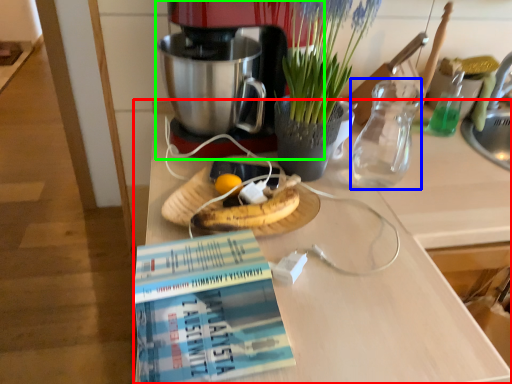
Question: Which object is positioned farthest from desk (highlighted by a red box)? Select from tea pot (highlighted by a blue box) and coffee maker (highlighted by a green box).

Choices:
 (A) tea pot
 (B) coffee maker

Answer: (B)